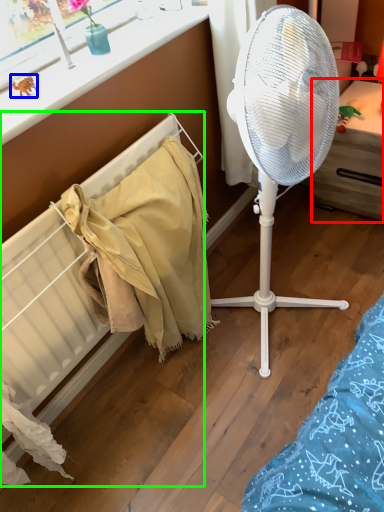
Question: Estimate the real-world distances between objects in this image. Which object is closer to furniture (highlighted by a red box), toy (highlighted by a blue box) or radiator (highlighted by a green box)?

Choices:
 (A) toy
 (B) radiator

Answer: (B)